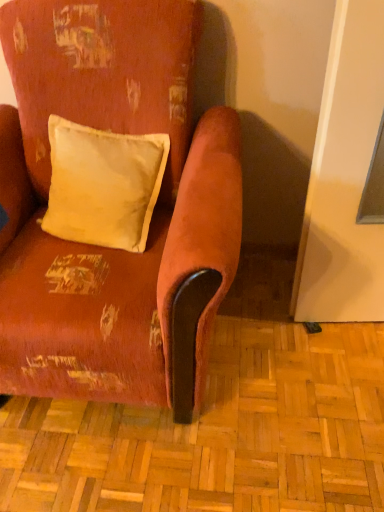
Question: From the image's perspective, is matte yellow cushion at upper left located above or below distressed velvet armchair at center?

Choices:
 (A) below
 (B) above

Answer: (B)

Question: Based on their sizes in the image, would you say matte yellow cushion at upper left is bigger or smaller than distressed velvet armchair at center?

Choices:
 (A) small
 (B) big

Answer: (A)

Question: Is matte yellow cushion at upper left to the left or to the right of distressed velvet armchair at center in the image?

Choices:
 (A) right
 (B) left

Answer: (A)

Question: Is point 221,272 positioned closer to the camera than point 89,202?

Choices:
 (A) farther
 (B) closer

Answer: (B)

Question: Based on their sizes in the image, would you say distressed velvet armchair at center is bigger or smaller than matte yellow cushion at upper left?

Choices:
 (A) big
 (B) small

Answer: (A)

Question: Considering their positions, is distressed velvet armchair at center located in front of or behind matte yellow cushion at upper left?

Choices:
 (A) front
 (B) behind

Answer: (A)

Question: From the image's perspective, is distressed velvet armchair at center located above or below matte yellow cushion at upper left?

Choices:
 (A) above
 (B) below

Answer: (B)